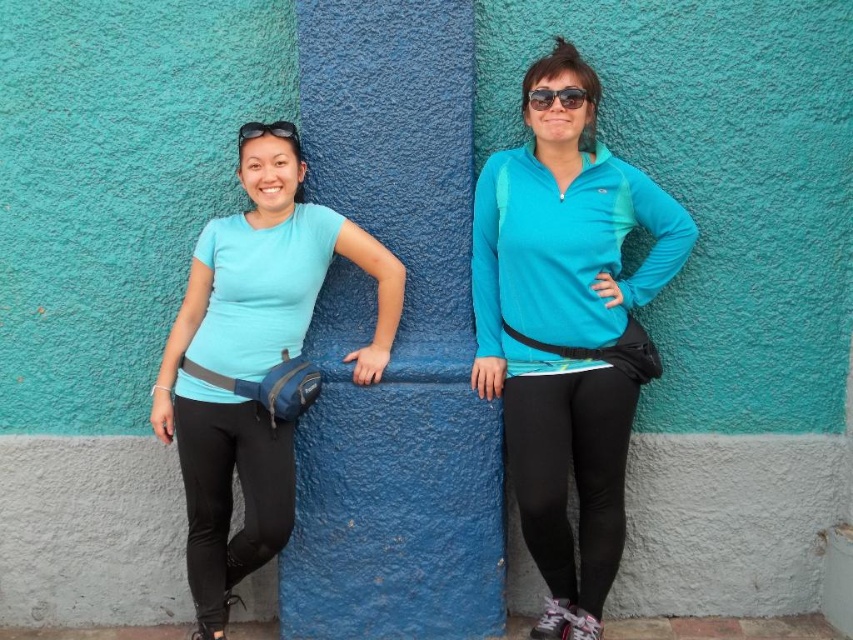
Can you confirm if matte black sunglasses at center is positioned above black rubber goggles at upper left?

Yes.

What do you see at coordinates (555, 97) in the screenshot?
I see `matte black sunglasses at center` at bounding box center [555, 97].

You are a GUI agent. You are given a task and a screenshot of the screen. Output one action in this format:
    pyautogui.click(x=<x>, y=<y>)
    Task: Click on the matte black sunglasses at center
    The image size is (853, 640).
    Given the screenshot: What is the action you would take?
    pyautogui.click(x=555, y=97)

In order to click on matte black sunglasses at center in this screenshot , I will do `click(555, 97)`.

You are a GUI agent. You are given a task and a screenshot of the screen. Output one action in this format:
    pyautogui.click(x=<x>, y=<y>)
    Task: Click on the matte blue zip-up jacket at center
    Image resolution: width=853 pixels, height=640 pixels.
    Given the screenshot: What is the action you would take?
    pyautogui.click(x=567, y=332)

Is matte blue zip-up jacket at center thinner than matte blue shirt at left?

Yes, matte blue zip-up jacket at center is thinner than matte blue shirt at left.

Between point (659, 285) and point (376, 278), which one is positioned in front?

Point (376, 278)

This screenshot has height=640, width=853. I want to click on matte blue zip-up jacket at center, so click(x=567, y=332).

Which is above, matte blue shirt at left or matte black sunglasses at center?

matte black sunglasses at center is above.

Is matte blue shirt at left positioned in front of matte black sunglasses at center?

No, it is behind matte black sunglasses at center.

Which is behind, point (204, 509) or point (543, 108)?

Positioned behind is point (204, 509).

I want to click on matte blue shirt at left, so click(253, 364).